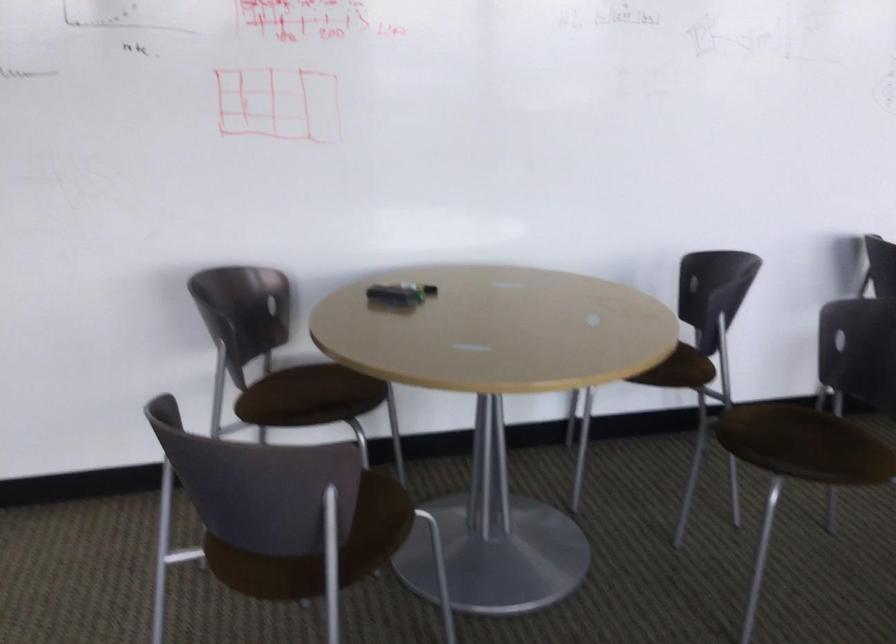
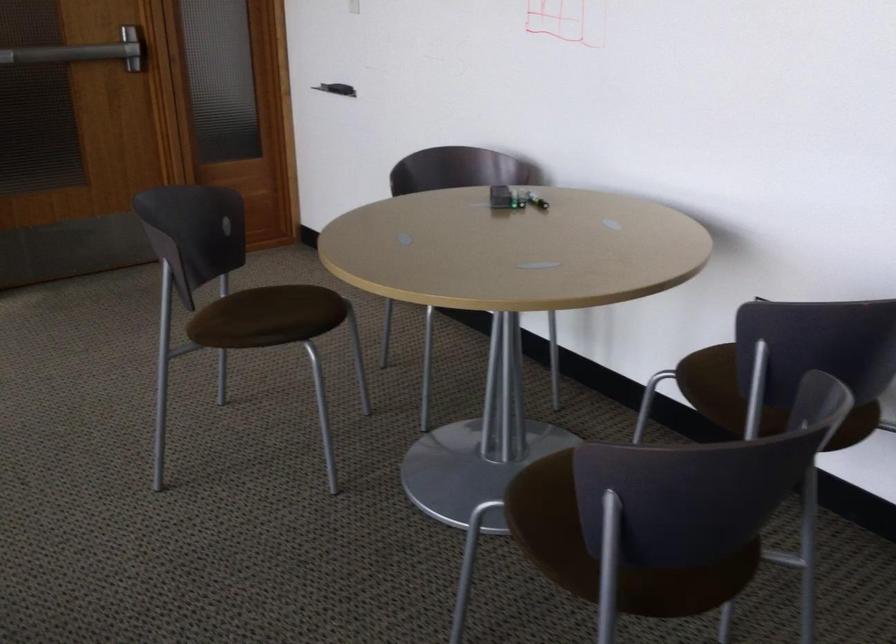
Locate, in the second image, the point that corresponds to [334,516] in the first image.

(276, 317)